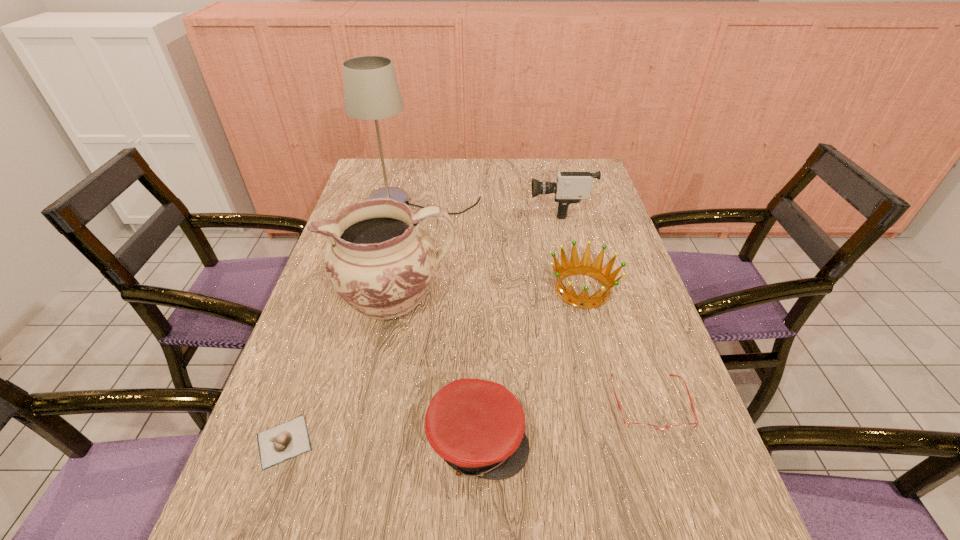
Where is `free space between the third tallest object and the cap`? free space between the third tallest object and the cap is located at coordinates (518, 324).

Where is `vacant area between the sixth tallest object and the fifth shortest object`? vacant area between the sixth tallest object and the fifth shortest object is located at coordinates (605, 306).

Locate an element on the screen. The height and width of the screenshot is (540, 960). free area in between the cap and the table lamp is located at coordinates (450, 322).

The height and width of the screenshot is (540, 960). I want to click on vacant space that is in between the crown and the fifth shortest object, so click(571, 249).

At what (x,y) coordinates should I click in order to perform the action: click on vacant region between the shortest object and the camcorder. Please return your answer as a coordinate pair (x, y). The image size is (960, 540). Looking at the image, I should click on (421, 326).

In order to click on empty space between the cap and the tallest object in this screenshot , I will do `click(450, 322)`.

This screenshot has width=960, height=540. Find the location of `empty location between the garlic and the tallest object`. empty location between the garlic and the tallest object is located at coordinates (353, 323).

At what (x,y) coordinates should I click in order to perform the action: click on object that is the sixth closest to the table lamp. Please return your answer as a coordinate pair (x, y). The height and width of the screenshot is (540, 960). Looking at the image, I should click on (278, 444).

Where is `object that can be found as the second closest to the garlic`? The width and height of the screenshot is (960, 540). object that can be found as the second closest to the garlic is located at coordinates (477, 426).

Where is `blank area in the image that satisfies the following two spatial constraints: 1. on the recording direction of the crown; 2. on the right side of the third tallest object`? This screenshot has width=960, height=540. blank area in the image that satisfies the following two spatial constraints: 1. on the recording direction of the crown; 2. on the right side of the third tallest object is located at coordinates (579, 289).